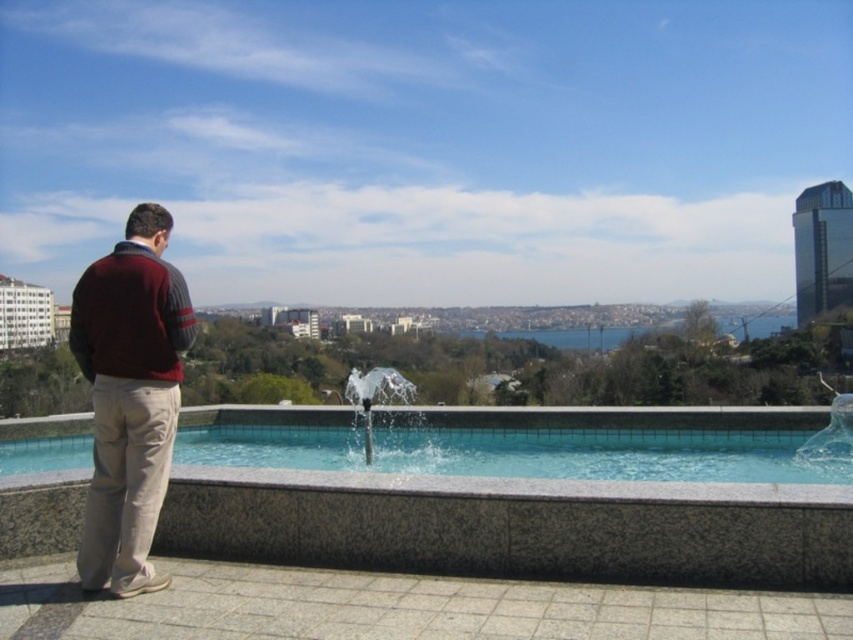
Between point (97, 372) and point (343, 394), which one is positioned behind?

Positioned behind is point (343, 394).

Between maroon sweater at left and clear glass water at center, which one is positioned lower?

clear glass water at center is lower down.

Is point (113, 396) more distant than point (363, 419)?

No, (113, 396) is closer to viewer.

You are a GUI agent. You are given a task and a screenshot of the screen. Output one action in this format:
    pyautogui.click(x=<x>, y=<y>)
    Task: Click on the maroon sweater at left
    This screenshot has width=853, height=640.
    Given the screenshot: What is the action you would take?
    pyautogui.click(x=129, y=397)